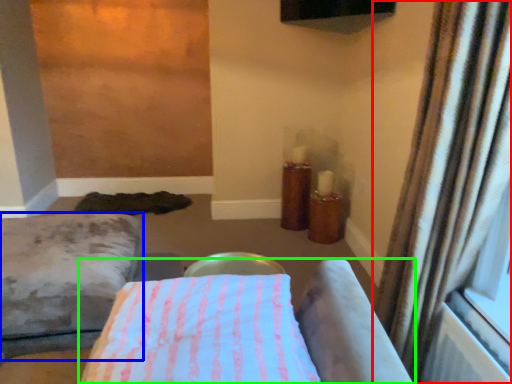
Question: Estimate the real-world distances between objects in this image. Which object is farther from curtain (highlighted by a red box), furniture (highlighted by a blue box) or furniture (highlighted by a green box)?

Choices:
 (A) furniture
 (B) furniture

Answer: (A)